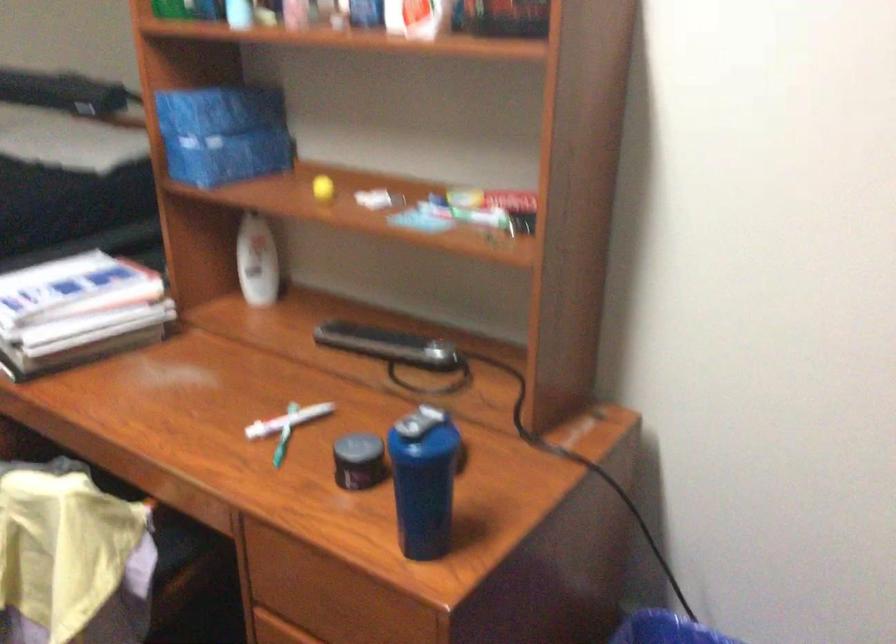
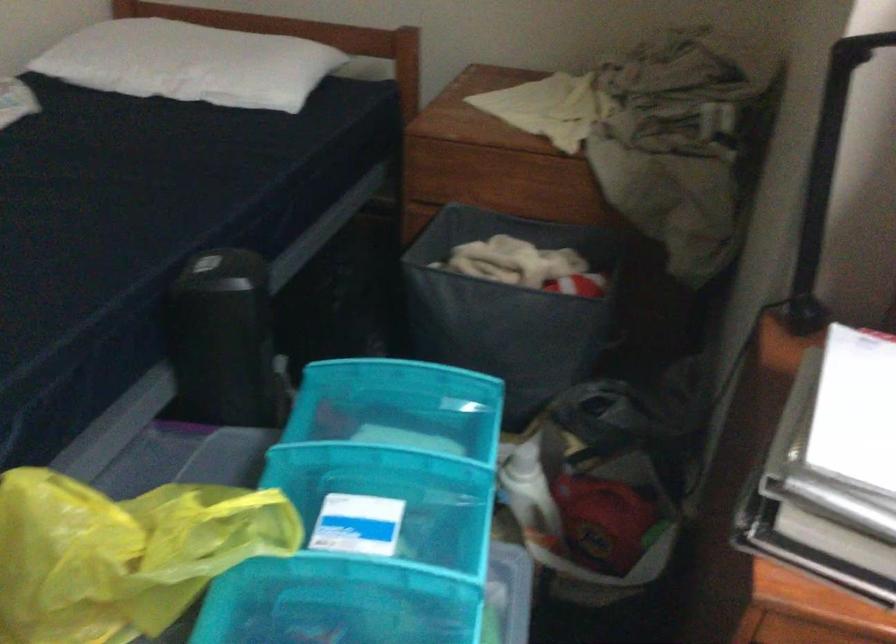
The images are taken continuously from a first-person perspective. In which direction are you moving?

The cameraman moved toward left, forward.